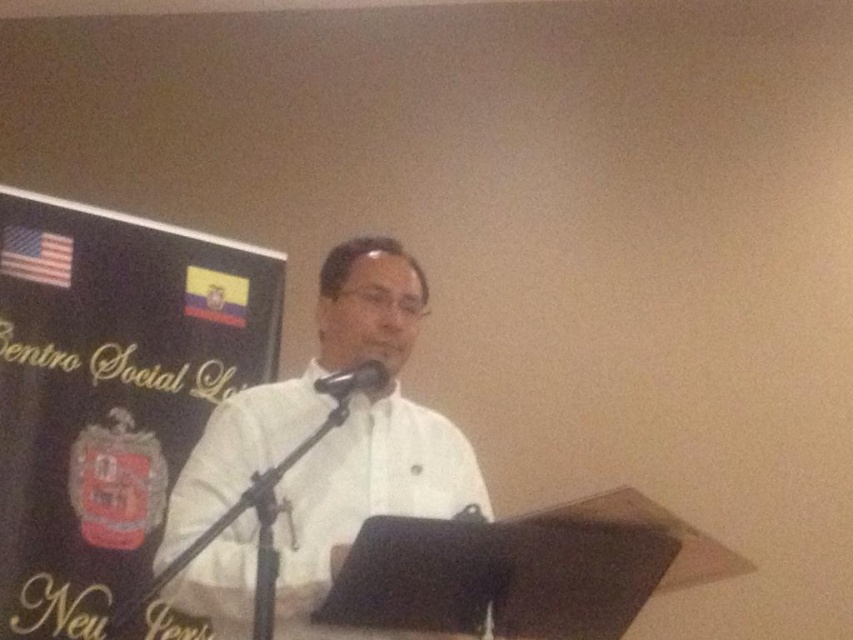
Question: Among these objects, which one is nearest to the camera?

Choices:
 (A) white glossy shirt at center
 (B) black fabric at left
 (C) black matte microphone at center

Answer: (A)

Question: Is black fabric at left below black matte microphone at center?

Choices:
 (A) no
 (B) yes

Answer: (B)

Question: Can you confirm if black fabric at left is positioned to the left of white glossy shirt at center?

Choices:
 (A) no
 (B) yes

Answer: (B)

Question: Among these points, which one is farthest from the camera?

Choices:
 (A) (108, 452)
 (B) (370, 364)
 (C) (326, 289)

Answer: (A)

Question: Is black fabric at left smaller than white glossy shirt at center?

Choices:
 (A) yes
 (B) no

Answer: (B)

Question: Which point is closer to the camera?

Choices:
 (A) (286, 394)
 (B) (367, 394)
 (C) (44, 552)

Answer: (B)